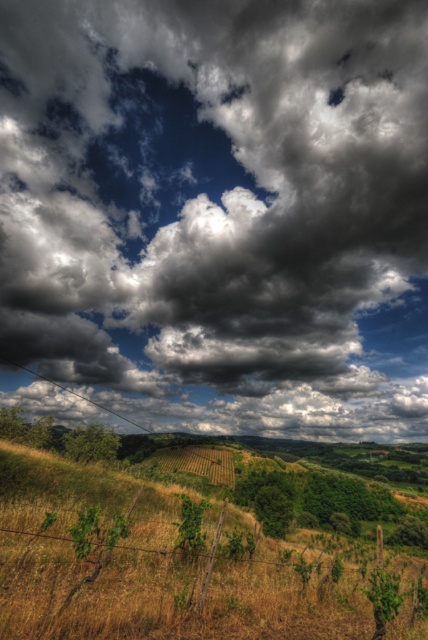
Question: Which point is closer to the camera?

Choices:
 (A) (303, 598)
 (B) (264, 400)

Answer: (A)

Question: Does dark gray cloud at upper center have a greater width compared to green grassy field at center?

Choices:
 (A) no
 (B) yes

Answer: (B)

Question: Can you confirm if dark gray cloud at upper center is bigger than green grassy field at center?

Choices:
 (A) no
 (B) yes

Answer: (B)

Question: Which of the following is the farthest from the observer?

Choices:
 (A) green grassy field at center
 (B) dark gray cloud at upper center

Answer: (B)

Question: From the image, what is the correct spatial relationship of dark gray cloud at upper center in relation to green grassy field at center?

Choices:
 (A) left
 (B) right

Answer: (B)

Question: Which object is closer to the camera taking this photo?

Choices:
 (A) dark gray cloud at upper center
 (B) green grassy field at center

Answer: (B)